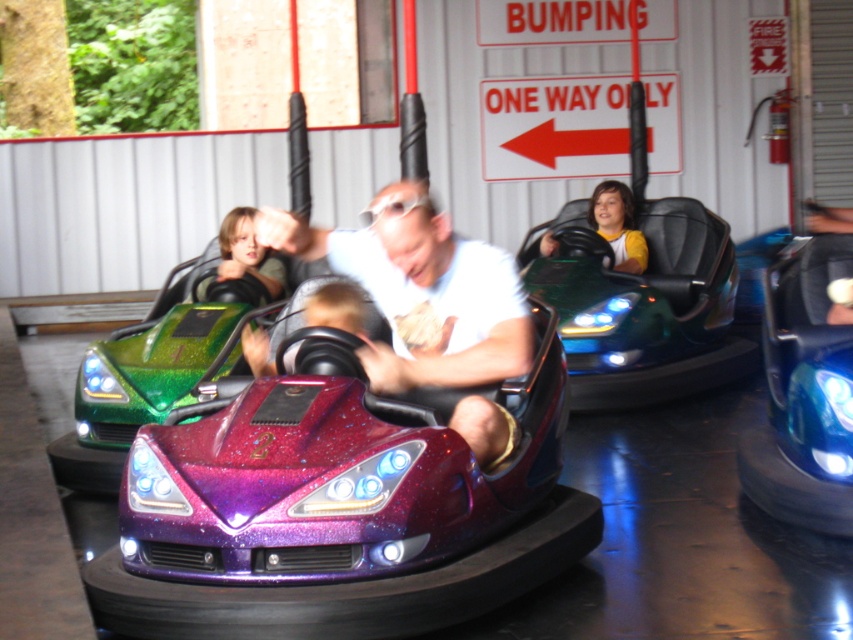
You are a photographer taking a picture of the smooth skin child at center and the yellow cotton shirt at center. Which object should you focus on first if you want to capture both in focus?

The smooth skin child at center has a lesser height compared to the yellow cotton shirt at center, so you should focus on the yellow cotton shirt at center first since it is taller and might be in the background.

You are a parent at an amusement park and want to ensure your child can safely reach the steering wheel of the shiny metallic car at center. Given that the smooth skin child at center is 1.2 meters tall, can the child safely reach the steering wheel?

The shiny metallic car at center is larger in size compared to the smooth skin child at center. Since the child is 1.2 meters tall, the larger size of the car may mean the steering wheel is positioned higher, making it difficult for the child to reach safely. It is recommended to check the car manufacturer guidelines or consult staff for age and height requirements.

Based on the scene description, where exactly is the shiny metallic car at center located in the image?

The shiny metallic car at center is located at point coordinates of [421,291].